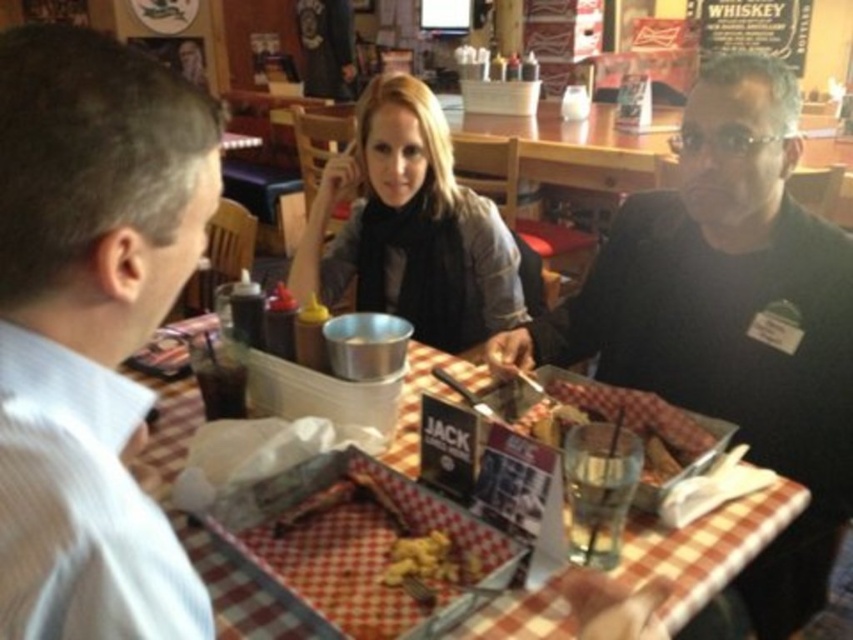
You are a server in a diner and need to place a 1.2 meter long tray on the table. The table has a matte black scarf at center and golden crispy nuggets at center. Is there enough space between them to fit the tray?

The distance between the matte black scarf at center and golden crispy nuggets at center is 1.09 meters, which is shorter than the 1.2 meter long tray. Therefore, the tray cannot fit between them.

You are a diner customer who wants to place the golden crispy nuggets at center onto the checkered plastic tray at center. Can you fit them without moving any other items on the table?

The checkered plastic tray at center is wider than the golden crispy nuggets at center, so yes, you can fit them without moving other items on the table.

You are a customer sitting at the table in the center of the diner. You notice two points on the tablecloth marked as point A and point B. Point A has coordinates point A at (444, 349) and point B has coordinates point B at (397, 573). If you want to reach the point that is closer to you, which point should you choose?

Point A at (444, 349) is closer to you because it is further to the camera than point B at (397, 573), meaning it is positioned nearer in the scene.